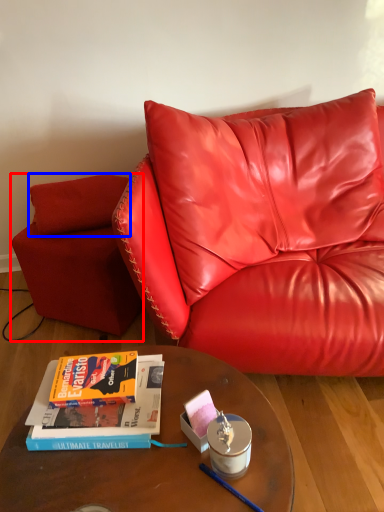
Question: Which object appears farthest to the camera in this image, armchair (highlighted by a red box) or pillow (highlighted by a blue box)?

Choices:
 (A) armchair
 (B) pillow

Answer: (B)